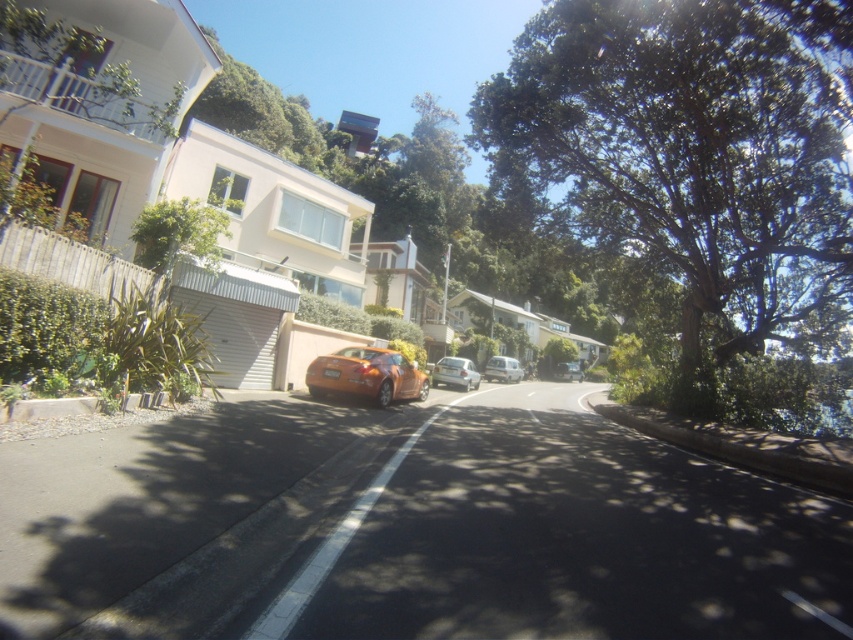
Question: Which of these objects is positioned farthest from the silver metallic car at center?

Choices:
 (A) satin silver car at center
 (B) metallic silver car at center
 (C) orange matte sports car at center

Answer: (C)

Question: Which point is closer to the camera?

Choices:
 (A) (380, 348)
 (B) (706, 156)
 (C) (556, 372)
 (D) (502, 376)

Answer: (B)

Question: In this image, where is orange matte sports car at center located relative to metallic silver car at center?

Choices:
 (A) below
 (B) above

Answer: (B)

Question: Can you confirm if green leafy tree at upper right is positioned below satin silver car at center?

Choices:
 (A) yes
 (B) no

Answer: (B)

Question: Which point is closer to the camera taking this photo?

Choices:
 (A) (543, 129)
 (B) (518, 376)
 (C) (473, 365)

Answer: (A)

Question: Does orange matte sports car at center appear under metallic silver car at center?

Choices:
 (A) no
 (B) yes

Answer: (A)